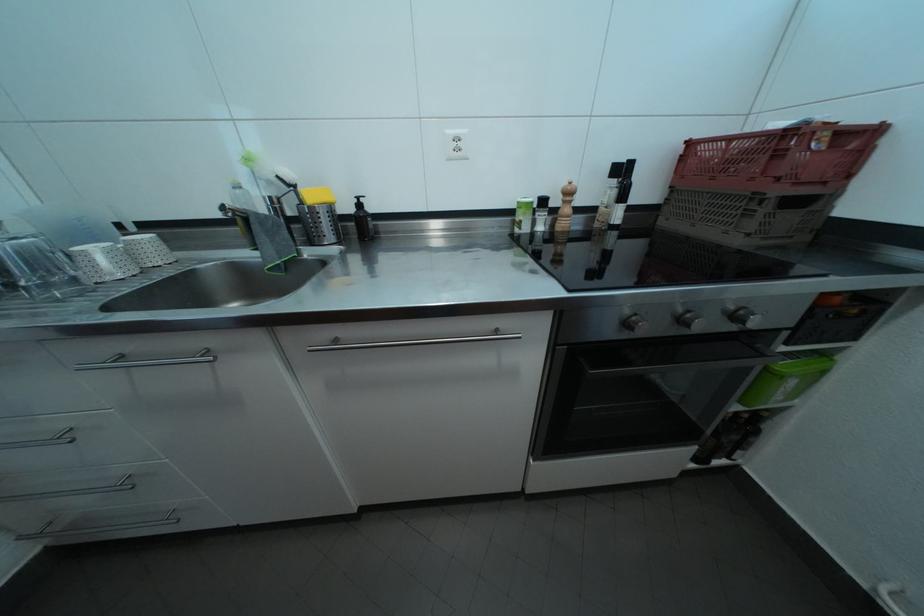
The image size is (924, 616). I want to click on white power outlet, so click(456, 145).